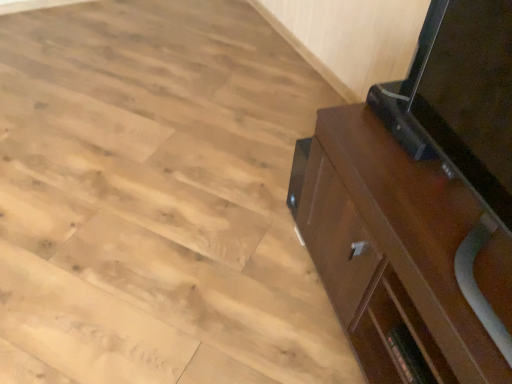
Find the location of a particular element. The image size is (512, 384). vacant space situated above dark brown wood cabinet at right (from a real-world perspective) is located at coordinates (435, 207).